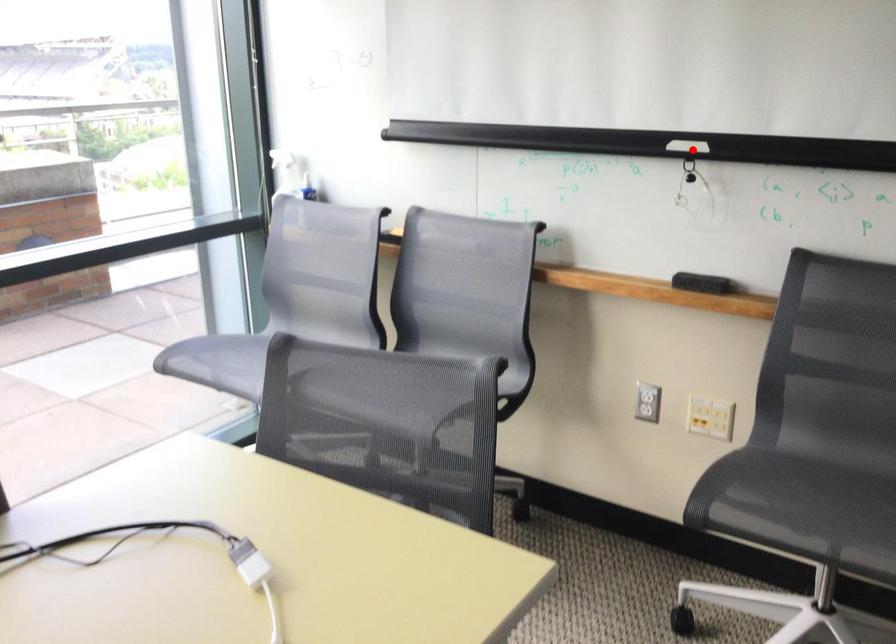
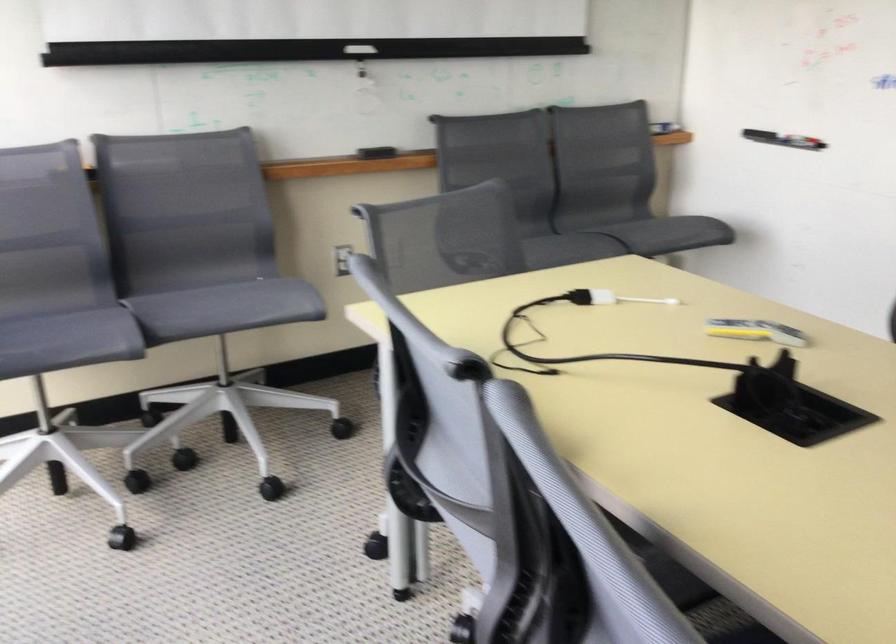
Find the pixel in the second image that matches the highlighted location in the first image.

(359, 49)